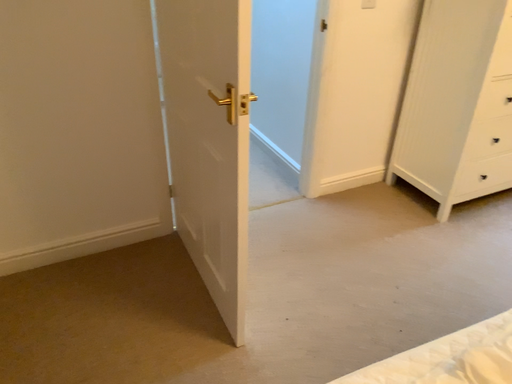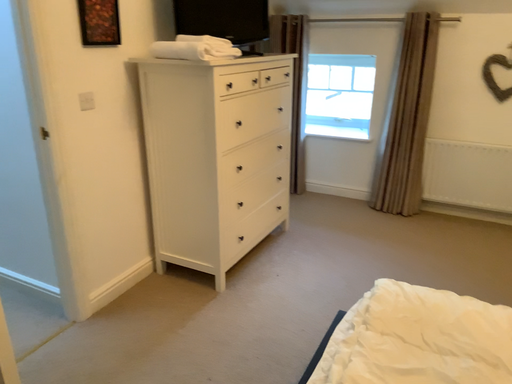
Question: Which way did the camera rotate in the video?

Choices:
 (A) rotated right
 (B) rotated left

Answer: (A)